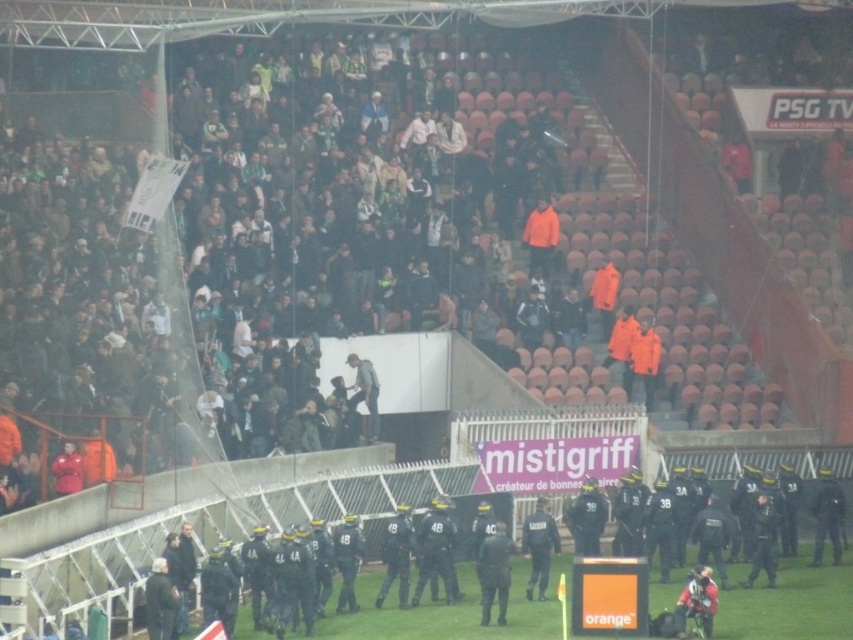
Question: Estimate the real-world distances between objects in this image. Which object is farther from the dark green uniform at center?

Choices:
 (A) black matte uniform at center
 (B) black uniformed officer at center

Answer: (B)

Question: Does dark green uniform at center have a greater width compared to black uniformed officer at center?

Choices:
 (A) no
 (B) yes

Answer: (A)

Question: Considering the real-world distances, which object is farthest from the black uniformed officer at center?

Choices:
 (A) dark green uniform at center
 (B) black matte uniform at center

Answer: (A)

Question: Is black matte uniform at center positioned behind black uniformed officer at center?

Choices:
 (A) no
 (B) yes

Answer: (A)

Question: Which point appears farthest from the camera in this image?

Choices:
 (A) [415, 596]
 (B) [480, 604]

Answer: (A)

Question: Is black matte uniform at center bigger than dark green uniform at center?

Choices:
 (A) yes
 (B) no

Answer: (A)